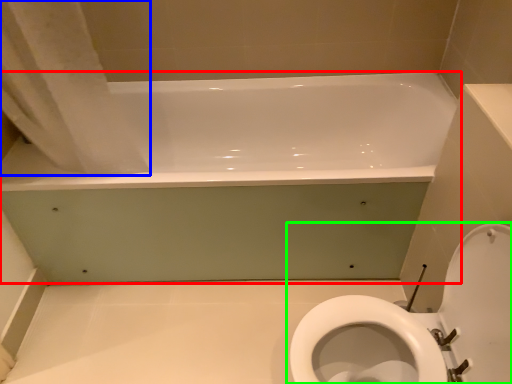
Question: Based on their relative distances, which object is nearer to bathtub (highlighted by a red box)? Choose from shower curtain (highlighted by a blue box) and toilet (highlighted by a green box).

Choices:
 (A) shower curtain
 (B) toilet

Answer: (A)